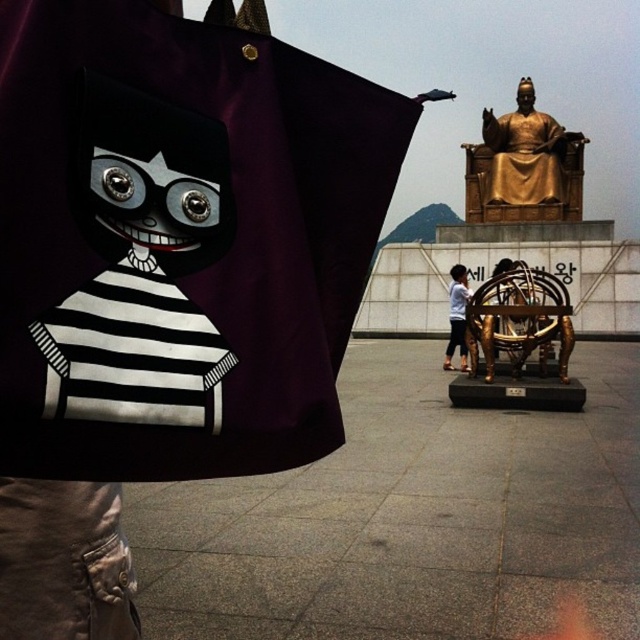
Question: Is gold metallic sculpture at center below white cotton shirt at center?

Choices:
 (A) no
 (B) yes

Answer: (A)

Question: Which object is farther from the camera taking this photo?

Choices:
 (A) gold metallic statue at upper right
 (B) gold metallic sculpture at center
 (C) white cotton shirt at center

Answer: (A)

Question: Which object appears closest to the camera in this image?

Choices:
 (A) gold metallic statue at upper right
 (B) white cotton shirt at center
 (C) gold metallic sculpture at center

Answer: (C)

Question: Can you confirm if gold metallic sculpture at center is thinner than white cotton shirt at center?

Choices:
 (A) yes
 (B) no

Answer: (B)

Question: Which point is farther from the camera taking this photo?

Choices:
 (A) (502, 145)
 (B) (451, 353)

Answer: (A)

Question: Is gold metallic statue at upper right closer to camera compared to gold metallic sculpture at center?

Choices:
 (A) no
 (B) yes

Answer: (A)